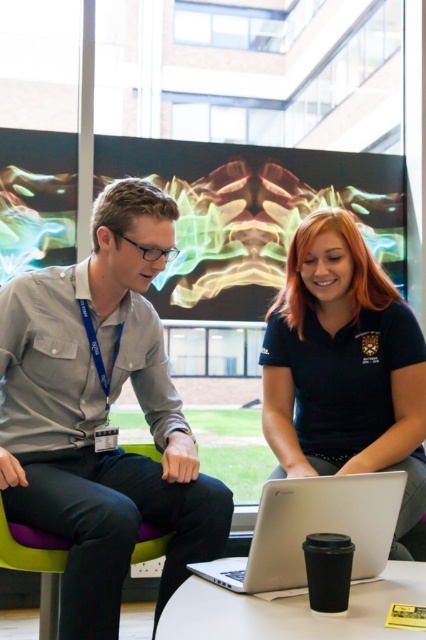
What do you see at coordinates (344, 365) in the screenshot? I see `black matte shirt at center` at bounding box center [344, 365].

Does black matte shirt at center have a greater width compared to white glossy table at lower center?

No, black matte shirt at center is not wider than white glossy table at lower center.

Where is `black matte shirt at center`? Image resolution: width=426 pixels, height=640 pixels. black matte shirt at center is located at coordinates (344, 365).

Does silver metallic laptop at center lie behind purple fabric chair at lower left?

No, silver metallic laptop at center is in front of purple fabric chair at lower left.

Does silver metallic laptop at center have a larger size compared to purple fabric chair at lower left?

No, silver metallic laptop at center is not bigger than purple fabric chair at lower left.

Between point (284, 577) and point (52, 593), which one is positioned behind?

The point (52, 593) is behind.

Where is `silver metallic laptop at center`? silver metallic laptop at center is located at coordinates (313, 529).

Can you confirm if black matte shirt at center is bigger than purple fabric chair at lower left?

Indeed, black matte shirt at center has a larger size compared to purple fabric chair at lower left.

Does black matte shirt at center appear under purple fabric chair at lower left?

No.

Find the location of a particular element. The width and height of the screenshot is (426, 640). black matte shirt at center is located at coordinates click(344, 365).